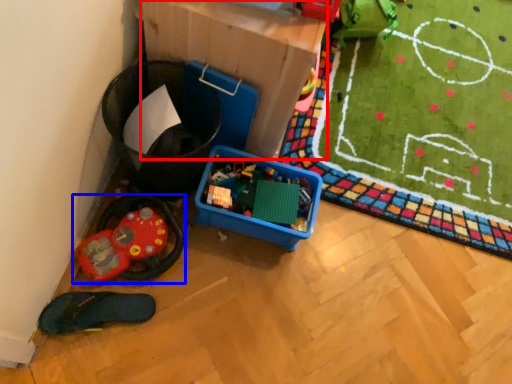
Question: Which object appears closest to the camera in this image, cardboard box (highlighted by a red box) or toy (highlighted by a blue box)?

Choices:
 (A) cardboard box
 (B) toy

Answer: (A)